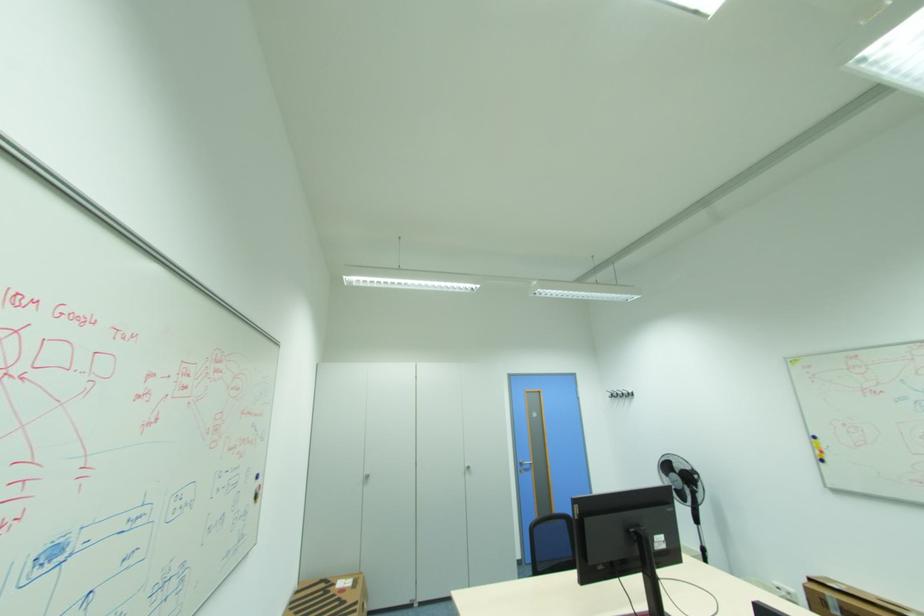
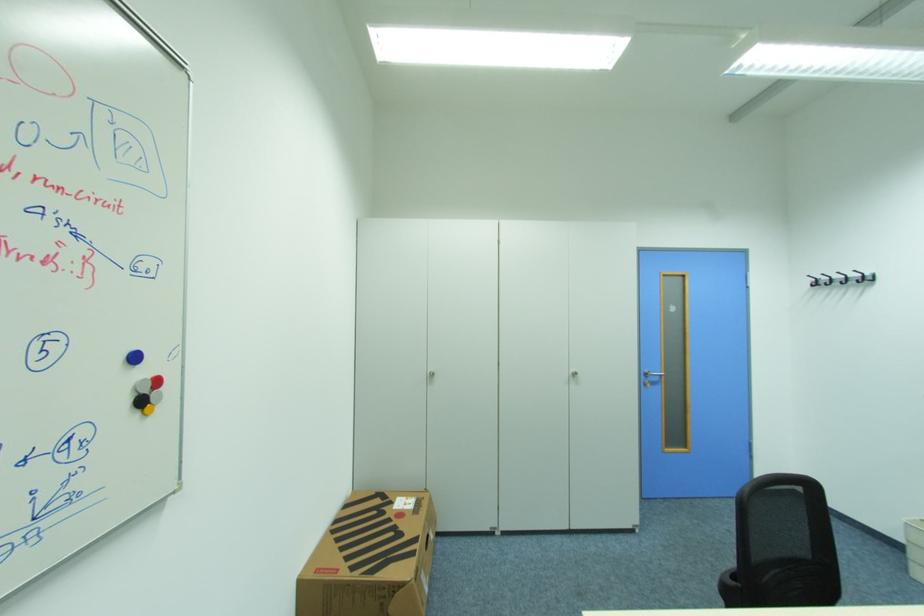
Where in the second image is the point corresponding to (636,392) from the first image?

(872, 275)